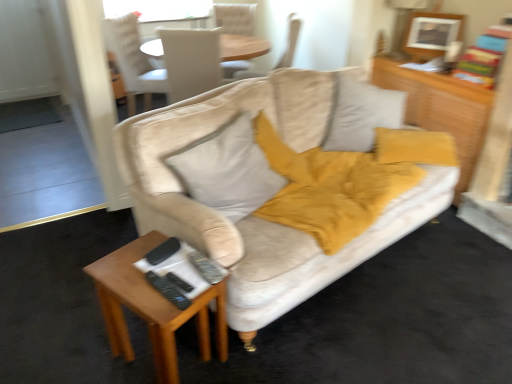
How much space does light beige fabric chair at upper center, the second chair in the right-to-left sequence, occupy horizontally?

24.69 inches.

This screenshot has height=384, width=512. What do you see at coordinates (234, 18) in the screenshot?
I see `light beige fabric chair at upper center, arranged as the 3th chair when viewed from the left` at bounding box center [234, 18].

What are the coordinates of `wooden dresser at upper right` in the screenshot? It's located at (441, 109).

Locate an element on the screen. beige fabric chair at upper center, the third chair from the right is located at coordinates (191, 62).

What is the approximate width of beige fabric chair at upper center, arranged as the second chair when viewed from the left?

It is 66.57 centimeters.

The height and width of the screenshot is (384, 512). In order to click on beige fabric chair at upper center, the fourth chair from the left in this screenshot , I will do `click(290, 42)`.

What is the approximate width of velvet beige couch at center?

velvet beige couch at center is 4.89 meters in width.

This screenshot has height=384, width=512. Describe the element at coordinates (263, 182) in the screenshot. I see `velvet beige couch at center` at that location.

The width and height of the screenshot is (512, 384). I want to click on soft white pillow at center, so click(x=227, y=170).

Where is `light beige fabric chair at upper center, the second chair in the right-to-left sequence`? The width and height of the screenshot is (512, 384). light beige fabric chair at upper center, the second chair in the right-to-left sequence is located at coordinates tap(234, 18).

Is light beige fabric chair at upper center, arranged as the 3th chair when viewed from the left, closer to camera compared to velvet beige couch at center?

No.

Does light beige fabric chair at upper center, the second chair in the right-to-left sequence, appear on the left side of velvet beige couch at center?

No.

Is there a large distance between light beige fabric chair at upper center, the second chair in the right-to-left sequence, and velvet beige couch at center?

Yes, light beige fabric chair at upper center, the second chair in the right-to-left sequence, and velvet beige couch at center are located far from each other.

Which is nearer, (234, 9) or (197, 248)?

The point (197, 248) is in front.

Looking at this image, from their relative heights in the image, would you say beige fabric chair at upper center, which ranks as the first chair in right-to-left order, is taller or shorter than soft white pillow at center?

Considering their sizes, beige fabric chair at upper center, which ranks as the first chair in right-to-left order, has more height than soft white pillow at center.

Which of these two, beige fabric chair at upper center, which ranks as the first chair in right-to-left order, or soft white pillow at center, is thinner?

With smaller width is soft white pillow at center.

From a real-world perspective, is beige fabric chair at upper center, which ranks as the first chair in right-to-left order, located higher than soft white pillow at center?

Yes, from a real-world perspective, beige fabric chair at upper center, which ranks as the first chair in right-to-left order, is on top of soft white pillow at center.

From the image's perspective, relative to beige fabric chair at upper center, the third chair from the right, is soft white pillow at center above or below?

Clearly, from the image's perspective, soft white pillow at center is below beige fabric chair at upper center, the third chair from the right.

Is soft white pillow at center wider or thinner than beige fabric chair at upper center, the third chair from the right?

soft white pillow at center is thinner than beige fabric chair at upper center, the third chair from the right.

Is point (225, 201) positioned after point (170, 35)?

No, it is not.

This screenshot has width=512, height=384. I want to click on pillow lying below the beige fabric chair at upper center, the third chair from the right (from the image's perspective), so click(x=227, y=170).

Could you tell me if beige fabric chair at upper center, which ranks as the first chair in right-to-left order, is facing white fabric chair at upper center, the 4th chair viewed from the right?

Yes.

Identify the location of the 1st chair behind the beige fabric chair at upper center, the fourth chair from the left. (132, 60).

Is beige fabric chair at upper center, which ranks as the first chair in right-to-left order, spatially inside white fabric chair at upper center, the 4th chair viewed from the right, or outside of it?

beige fabric chair at upper center, which ranks as the first chair in right-to-left order, is not enclosed by white fabric chair at upper center, the 4th chair viewed from the right.

How different are the orientations of beige fabric chair at upper center, the fourth chair from the left, and white fabric chair at upper center, the 4th chair viewed from the right, in degrees?

There is a 173-degree angle between the facing directions of beige fabric chair at upper center, the fourth chair from the left, and white fabric chair at upper center, the 4th chair viewed from the right.

Is wooden dresser at upper right oriented towards wooden rectangular table at lower left?

No, wooden dresser at upper right is not aimed at wooden rectangular table at lower left.

Is the position of wooden dresser at upper right less distant than that of wooden rectangular table at lower left?

No, wooden dresser at upper right is behind wooden rectangular table at lower left.

Is wooden dresser at upper right to the left of wooden rectangular table at lower left from the viewer's perspective?

In fact, wooden dresser at upper right is to the right of wooden rectangular table at lower left.

Does wooden dresser at upper right have a smaller size compared to wooden rectangular table at lower left?

Yes, wooden dresser at upper right is smaller than wooden rectangular table at lower left.

Can you confirm if velvet beige couch at center is thinner than beige fabric chair at upper center, the fourth chair from the left?

In fact, velvet beige couch at center might be wider than beige fabric chair at upper center, the fourth chair from the left.

From the image's perspective, which is above, velvet beige couch at center or beige fabric chair at upper center, which ranks as the first chair in right-to-left order?

beige fabric chair at upper center, which ranks as the first chair in right-to-left order, appears higher in the image.

Can you confirm if velvet beige couch at center is positioned to the left of beige fabric chair at upper center, which ranks as the first chair in right-to-left order?

Yes.

From the picture: Is velvet beige couch at center in front of or behind beige fabric chair at upper center, which ranks as the first chair in right-to-left order, in the image?

velvet beige couch at center is in front of beige fabric chair at upper center, which ranks as the first chair in right-to-left order.

Is light beige fabric chair at upper center, arranged as the 3th chair when viewed from the left, far away from wooden dresser at upper right?

Indeed, light beige fabric chair at upper center, arranged as the 3th chair when viewed from the left, is not near wooden dresser at upper right.

Measure the distance between light beige fabric chair at upper center, the second chair in the right-to-left sequence, and wooden dresser at upper right.

They are 6.11 feet apart.

At what (x,y) coordinates should I click in order to perform the action: click on dresser that appears below the light beige fabric chair at upper center, arranged as the 3th chair when viewed from the left (from a real-world perspective). Please return your answer as a coordinate pair (x, y). Looking at the image, I should click on (441, 109).

Who is bigger, light beige fabric chair at upper center, the second chair in the right-to-left sequence, or wooden dresser at upper right?

light beige fabric chair at upper center, the second chair in the right-to-left sequence.

Where is `studio couch below the light beige fabric chair at upper center, arranged as the 3th chair when viewed from the left (from a real-world perspective)`? studio couch below the light beige fabric chair at upper center, arranged as the 3th chair when viewed from the left (from a real-world perspective) is located at coordinates (263, 182).

You are a GUI agent. You are given a task and a screenshot of the screen. Output one action in this format:
    pyautogui.click(x=<x>, y=<y>)
    Task: Click on the chair that is on the right side of soft white pillow at center
    This screenshot has width=512, height=384.
    Given the screenshot: What is the action you would take?
    pyautogui.click(x=290, y=42)

Estimate the real-world distances between objects in this image. Which object is further from wooden rectangular table at lower left, velvet beige couch at center or soft white pillow at center?

velvet beige couch at center.

Looking at the image, which one is located further to beige fabric chair at upper center, which ranks as the first chair in right-to-left order, velvet beige couch at center or light beige fabric chair at upper center, the second chair in the right-to-left sequence?

Based on the image, velvet beige couch at center appears to be further to beige fabric chair at upper center, which ranks as the first chair in right-to-left order.

When comparing their distances from light beige fabric chair at upper center, the second chair in the right-to-left sequence, does beige fabric chair at upper center, which ranks as the first chair in right-to-left order, or beige fabric chair at upper center, the third chair from the right, seem further?

beige fabric chair at upper center, the third chair from the right, lies further to light beige fabric chair at upper center, the second chair in the right-to-left sequence, than the other object.

From the image, which object appears to be nearer to wooden dresser at upper right, beige fabric chair at upper center, arranged as the second chair when viewed from the left, or beige fabric chair at upper center, which ranks as the first chair in right-to-left order?

beige fabric chair at upper center, which ranks as the first chair in right-to-left order.

From the picture: From the image, which object appears to be farther from beige fabric chair at upper center, which ranks as the first chair in right-to-left order, wooden dresser at upper right or light beige fabric chair at upper center, arranged as the 3th chair when viewed from the left?

Based on the image, wooden dresser at upper right appears to be further to beige fabric chair at upper center, which ranks as the first chair in right-to-left order.

Considering their positions, is beige fabric chair at upper center, the third chair from the right, positioned closer to velvet beige couch at center than beige fabric chair at upper center, the fourth chair from the left?

The object closer to velvet beige couch at center is beige fabric chair at upper center, the third chair from the right.

When comparing their distances from beige fabric chair at upper center, arranged as the second chair when viewed from the left, does white fabric chair at upper center, which ranks as the 1th chair in left-to-right order, or wooden rectangular table at lower left seem closer?

white fabric chair at upper center, which ranks as the 1th chair in left-to-right order, is positioned closer to the anchor beige fabric chair at upper center, arranged as the second chair when viewed from the left.

Based on their spatial positions, is soft white pillow at center or light beige fabric chair at upper center, arranged as the 3th chair when viewed from the left, further from velvet beige couch at center?

Among the two, light beige fabric chair at upper center, arranged as the 3th chair when viewed from the left, is located further to velvet beige couch at center.

Identify the location of dresser between wooden rectangular table at lower left and beige fabric chair at upper center, arranged as the second chair when viewed from the left, in the front-back direction. The image size is (512, 384). (441, 109).

The height and width of the screenshot is (384, 512). I want to click on pillow located between wooden rectangular table at lower left and white fabric chair at upper center, the 4th chair viewed from the right, in the depth direction, so click(x=227, y=170).

The image size is (512, 384). Find the location of `table located between velvet beige couch at center and light beige fabric chair at upper center, arranged as the 3th chair when viewed from the left, in the depth direction`. table located between velvet beige couch at center and light beige fabric chair at upper center, arranged as the 3th chair when viewed from the left, in the depth direction is located at coordinates (151, 308).

The image size is (512, 384). Find the location of `pillow positioned between wooden rectangular table at lower left and light beige fabric chair at upper center, arranged as the 3th chair when viewed from the left, from near to far`. pillow positioned between wooden rectangular table at lower left and light beige fabric chair at upper center, arranged as the 3th chair when viewed from the left, from near to far is located at coordinates coord(227,170).